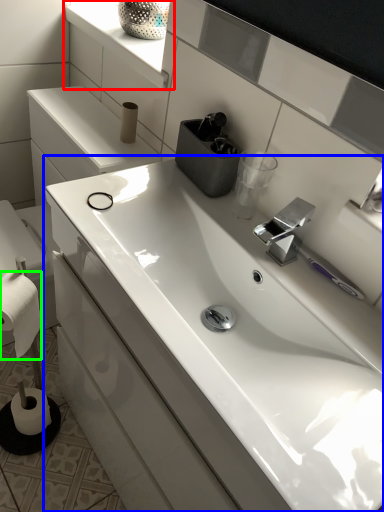
Question: Which object is the farthest from window sill (highlighted by a red box)? Choose among these: sink (highlighted by a blue box) or toilet paper (highlighted by a green box).

Choices:
 (A) sink
 (B) toilet paper

Answer: (B)